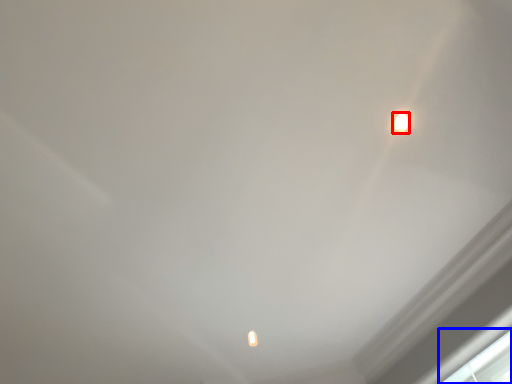
Question: Which of the following is the closest to the observer, lamp (highlighted by a red box) or window (highlighted by a blue box)?

Choices:
 (A) lamp
 (B) window

Answer: (A)